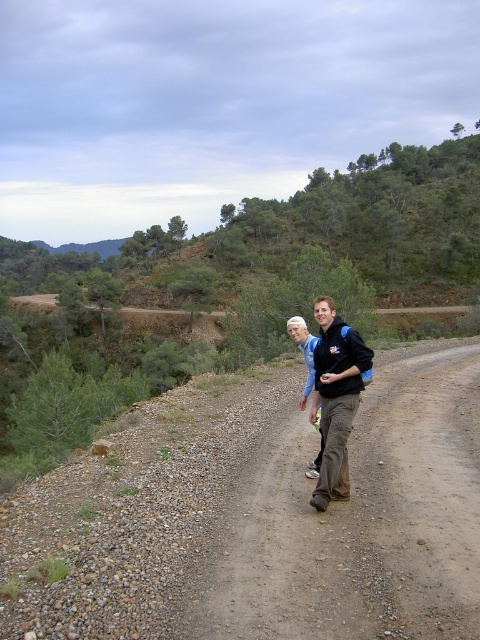
You are a photographer positioned at the camera location. You want to take a photo that includes both the point at position (220, 586) and the point at position (289, 333). Which point will appear larger in the photo?

The point at position (220, 586) will appear larger in the photo because it is closer to the camera than the point at position (289, 333).

You are a photographer standing at the camera position. You want to take a photo of the black softshell jacket at center. Where should you aim your camera to capture it?

You should aim your camera at point (336,396) to capture the black softshell jacket at center.

You are standing at the starting point of the dirt trail and want to reach the end of the trail. According to the coordinates provided, where exactly should you look to find the brown dirt trail at center?

The brown dirt trail at center is located at coordinates point (361, 518).